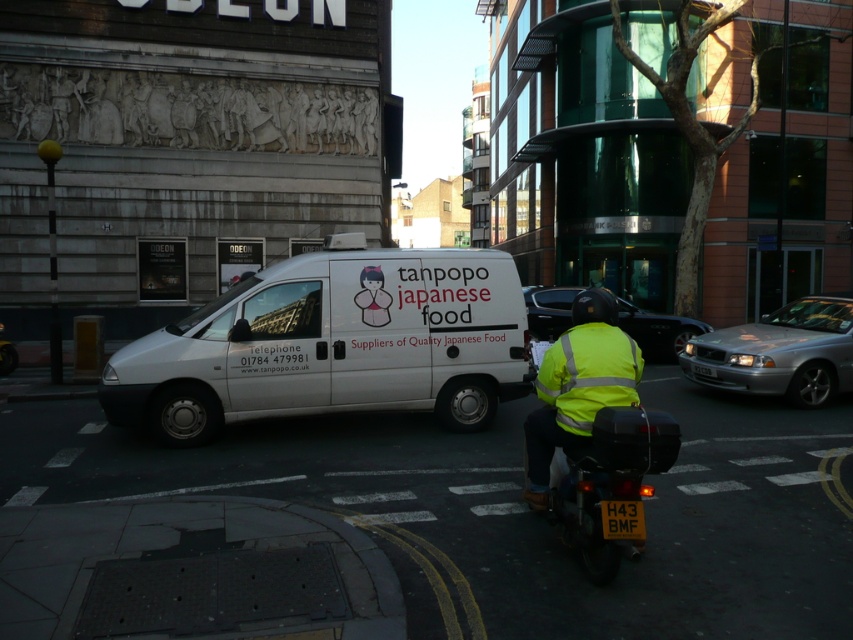
Is point (466, 337) closer to camera compared to point (552, 372)?

No, it is not.

Is white matte van at center above high visibility yellow fabric safety vest at center?

Indeed, white matte van at center is positioned over high visibility yellow fabric safety vest at center.

Image resolution: width=853 pixels, height=640 pixels. Describe the element at coordinates (332, 344) in the screenshot. I see `white matte van at center` at that location.

Where is `white matte van at center`? The image size is (853, 640). white matte van at center is located at coordinates (332, 344).

Can you confirm if high visibility yellow jacket at center is wider than shiny black car at center?

Incorrect, high visibility yellow jacket at center's width does not surpass shiny black car at center's.

Is point (560, 337) positioned after point (527, 289)?

No, (560, 337) is in front of (527, 289).

This screenshot has height=640, width=853. I want to click on high visibility yellow jacket at center, so click(595, 436).

Between point (727, 372) and point (544, 356), which one is positioned in front?

Point (544, 356) is in front.

Does silver metallic sedan at right appear on the right side of high visibility yellow fabric safety vest at center?

Yes, silver metallic sedan at right is to the right of high visibility yellow fabric safety vest at center.

Locate an element on the screen. This screenshot has height=640, width=853. silver metallic sedan at right is located at coordinates (779, 353).